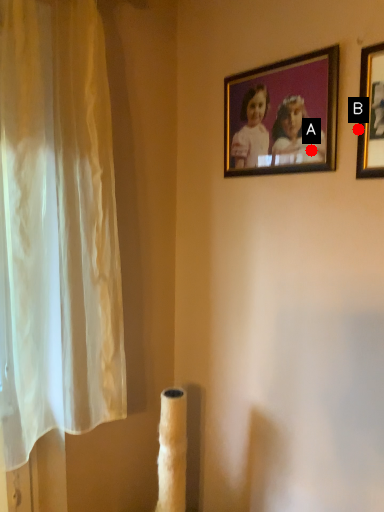
Question: Two points are circled on the image, labeled by A and B beside each circle. Which point is further to the camera?

Choices:
 (A) A is further
 (B) B is further

Answer: (A)